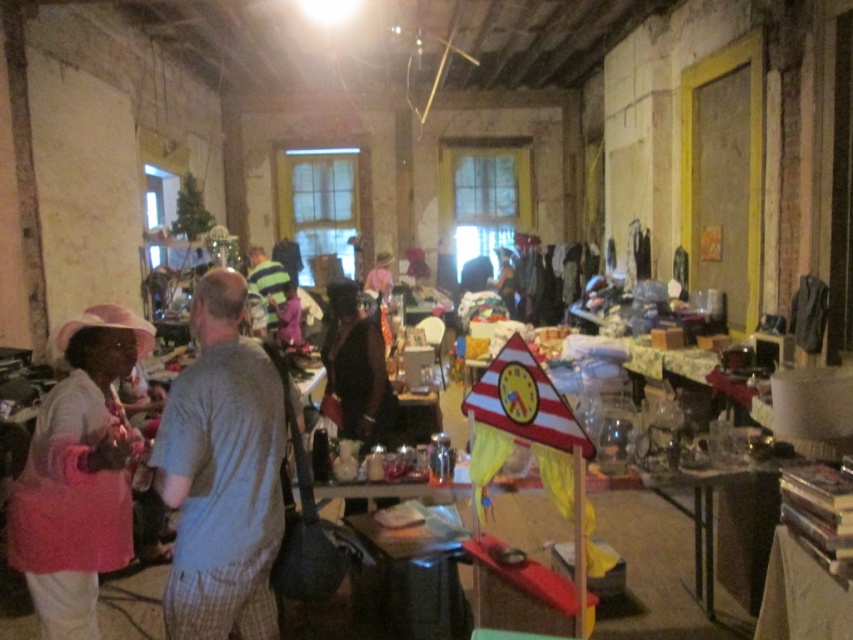
Question: Does pink fabric apron at left come behind brown leather jacket at center?

Choices:
 (A) no
 (B) yes

Answer: (A)

Question: Does pink fabric apron at left appear on the left side of brown leather jacket at center?

Choices:
 (A) no
 (B) yes

Answer: (B)

Question: Among these points, which one is farthest from the camera?

Choices:
 (A) (82, 410)
 (B) (177, 628)

Answer: (A)

Question: Which point is closer to the camera?

Choices:
 (A) (113, 518)
 (B) (358, 396)

Answer: (A)

Question: Which object is farther from the camera taking this photo?

Choices:
 (A) brown leather jacket at center
 (B) pink fabric apron at left

Answer: (A)

Question: Does gray cotton shirt at center appear on the right side of brown leather jacket at center?

Choices:
 (A) yes
 (B) no

Answer: (B)